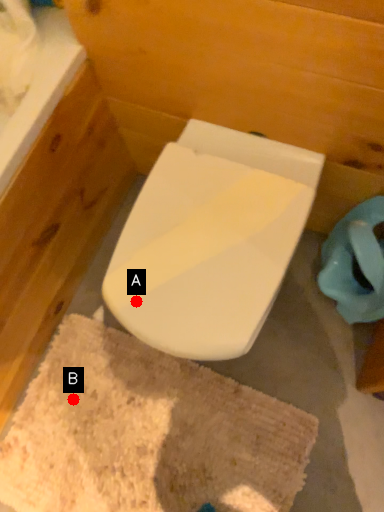
Question: Two points are circled on the image, labeled by A and B beside each circle. Among these points, which one is farthest from the camera?

Choices:
 (A) A is further
 (B) B is further

Answer: (B)